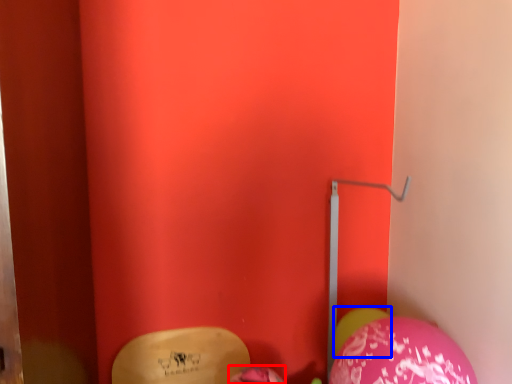
Question: Which point is closer to the camera, balloon (highlighted by a red box) or balloon (highlighted by a blue box)?

Choices:
 (A) balloon
 (B) balloon

Answer: (A)